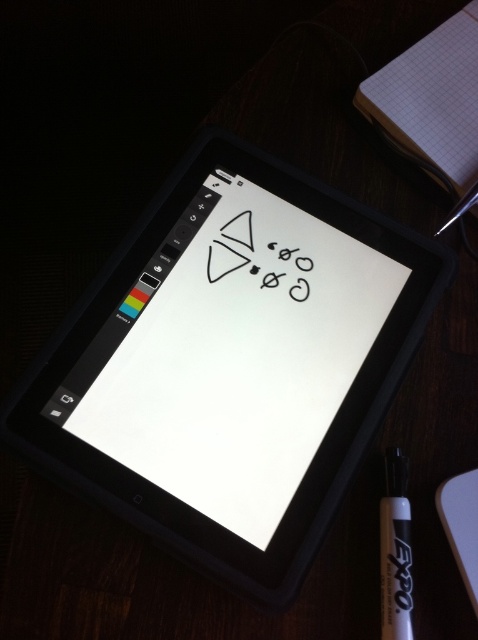
Question: Estimate the real-world distances between objects in this image. Which object is farther from the black plastic tablet at center?

Choices:
 (A) white grid paper at upper right
 (B) black marker pen at bottom right

Answer: (A)

Question: Does white grid paper at upper right lie behind black marker pen at bottom right?

Choices:
 (A) yes
 (B) no

Answer: (A)

Question: Can you confirm if black plastic tablet at center is smaller than white grid paper at upper right?

Choices:
 (A) yes
 (B) no

Answer: (B)

Question: Observing the image, what is the correct spatial positioning of white grid paper at upper right in reference to black marker pen at bottom right?

Choices:
 (A) above
 (B) below

Answer: (A)

Question: Which of these objects is positioned closest to the black plastic tablet at center?

Choices:
 (A) black marker pen at bottom right
 (B) white grid paper at upper right

Answer: (A)

Question: Which point is closer to the camera taking this photo?

Choices:
 (A) (384, 532)
 (B) (330, 246)

Answer: (A)